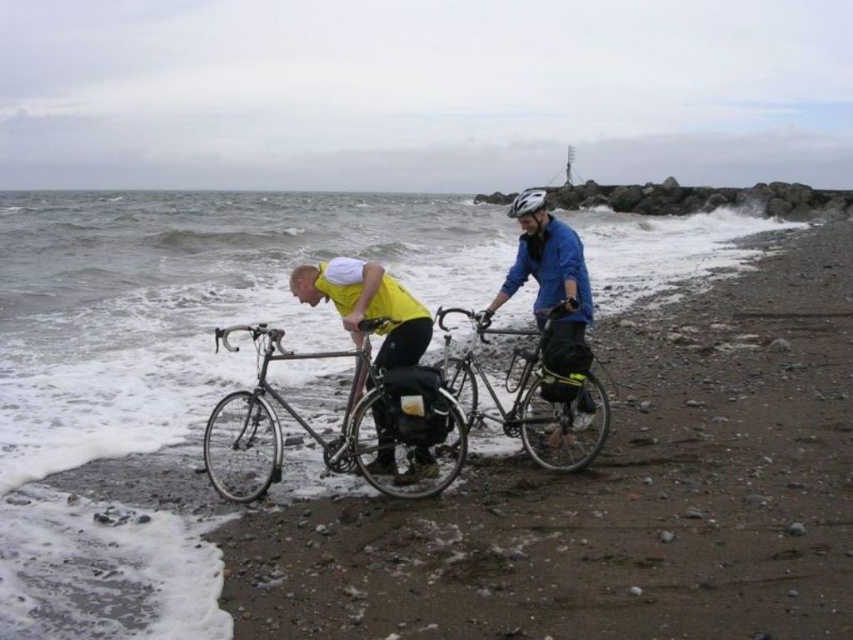
You are a photographer positioned at the edge of the rocky beach. You need to capture a photo of both the matte yellow jacket at center and the blue matte jacket at center in the same frame. Based on their positions, which jacket will appear closer to the top of the photo?

The matte yellow jacket at center is located above the blue matte jacket at center, so it will appear closer to the top of the photo.

You are a photographer standing on the rocky beach and want to take a photo of the shiny metallic bicycle at center and the yellow matte shirt at center. Which object should you focus on first if you want to capture both in the same frame without moving the camera?

The shiny metallic bicycle at center is not as tall as the yellow matte shirt at center, so you should focus on the yellow matte shirt at center first to ensure both are in the frame.